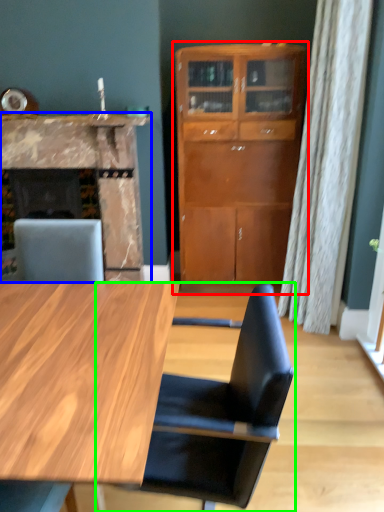
Question: Which object is positioned closest to cabinetry (highlighted by a red box)? Select from fireplace (highlighted by a blue box) and chair (highlighted by a green box).

Choices:
 (A) fireplace
 (B) chair

Answer: (A)